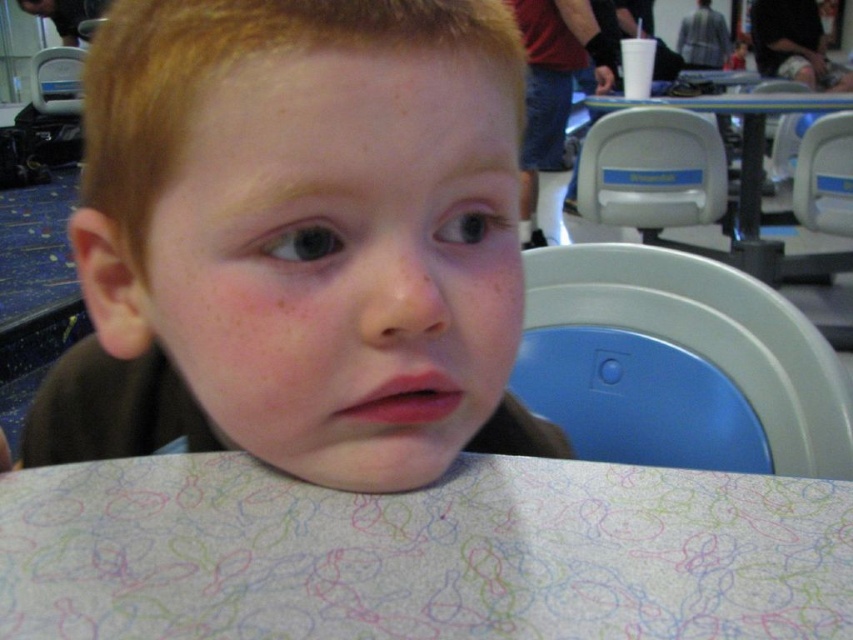
Question: Can you confirm if smooth skin child at center is wider than white paper at center?

Choices:
 (A) yes
 (B) no

Answer: (B)

Question: Is smooth skin child at center to the right of white paper at center from the viewer's perspective?

Choices:
 (A) no
 (B) yes

Answer: (A)

Question: Which point appears farthest from the camera in this image?

Choices:
 (A) (485, 464)
 (B) (779, 108)

Answer: (B)

Question: Based on their relative distances, which object is nearer to the white plastic table at center?

Choices:
 (A) smooth skin child at center
 (B) white paper at center

Answer: (A)

Question: Considering the real-world distances, which object is closest to the white paper at center?

Choices:
 (A) white plastic table at center
 (B) smooth skin child at center

Answer: (B)

Question: Does white paper at center have a smaller size compared to white plastic table at center?

Choices:
 (A) yes
 (B) no

Answer: (A)